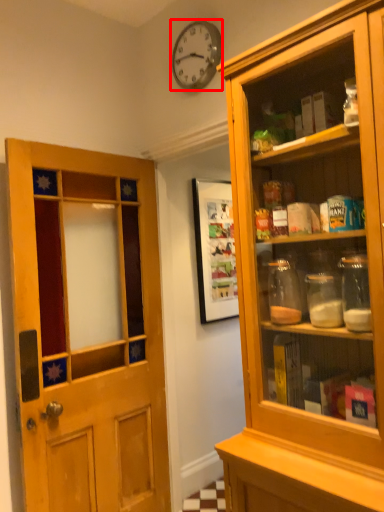
Question: Observing the image, what is the correct spatial positioning of clock (annotated by the red box) in reference to door?

Choices:
 (A) right
 (B) left

Answer: (A)